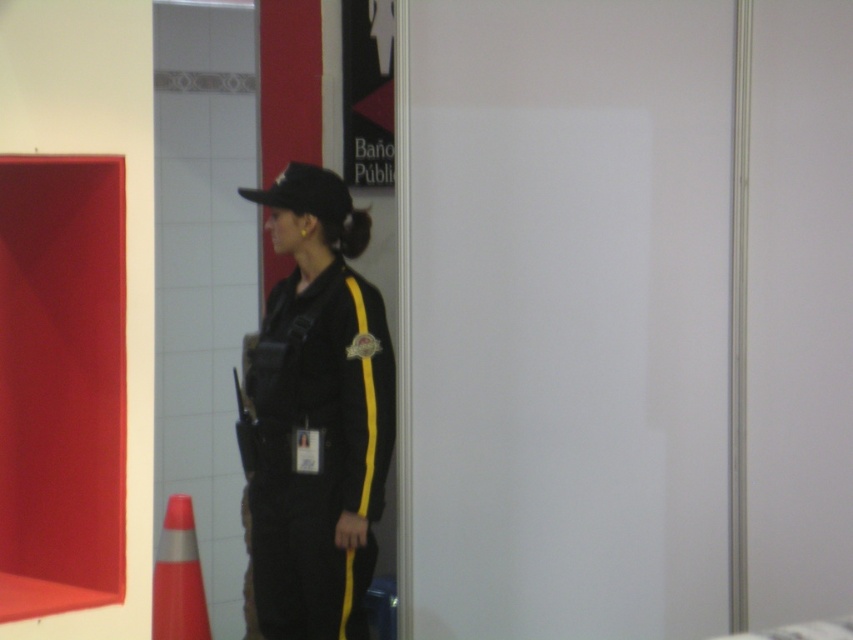
Question: Is black matte uniform at center to the left of orange reflective cone at lower left from the viewer's perspective?

Choices:
 (A) no
 (B) yes

Answer: (A)

Question: Which of the following is the farthest from the observer?

Choices:
 (A) (287, 168)
 (B) (165, 515)

Answer: (B)

Question: Is black matte uniform at center to the right of orange reflective cone at lower left from the viewer's perspective?

Choices:
 (A) no
 (B) yes

Answer: (B)

Question: Where is black matte uniform at center located in relation to orange reflective cone at lower left in the image?

Choices:
 (A) left
 (B) right

Answer: (B)